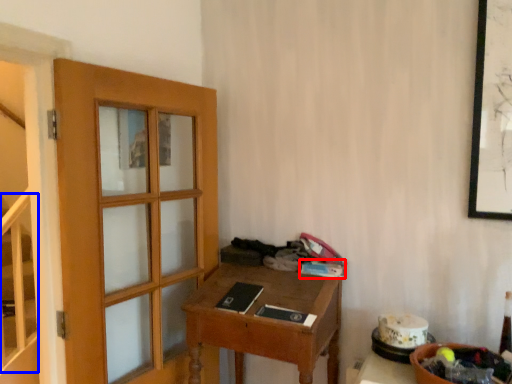
Question: Which object appears closest to the camera in this image, book (highlighted by a red box) or stairwell (highlighted by a blue box)?

Choices:
 (A) book
 (B) stairwell

Answer: (A)